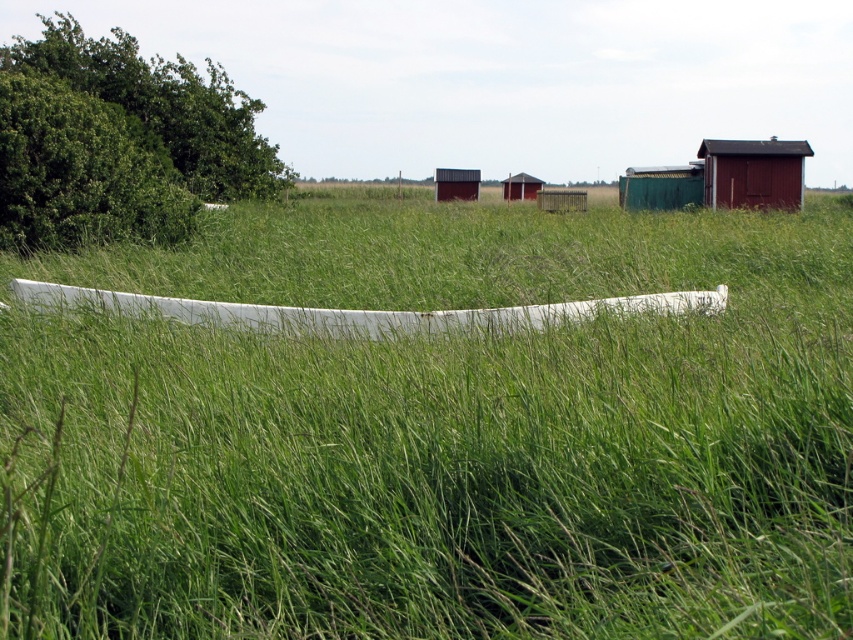
Question: Is white plastic pipe at center to the left of white plastic boat at center from the viewer's perspective?

Choices:
 (A) yes
 (B) no

Answer: (B)

Question: Does white plastic boat at center appear on the right side of wooden hut at center?

Choices:
 (A) yes
 (B) no

Answer: (B)

Question: Which point is closer to the camera?

Choices:
 (A) (796, 609)
 (B) (440, 177)
 (C) (360, 323)

Answer: (A)

Question: Does rustic wooden hut at center appear on the right side of wooden hut at center?

Choices:
 (A) yes
 (B) no

Answer: (B)

Question: Which point is closer to the camera?

Choices:
 (A) (361, 628)
 (B) (780, 150)
 (C) (514, 189)
 (D) (457, 172)

Answer: (A)

Question: Which of the following is the farthest from the observer?

Choices:
 (A) matte red wooden hut at upper right
 (B) rustic wooden hut at center
 (C) white plastic pipe at center

Answer: (B)